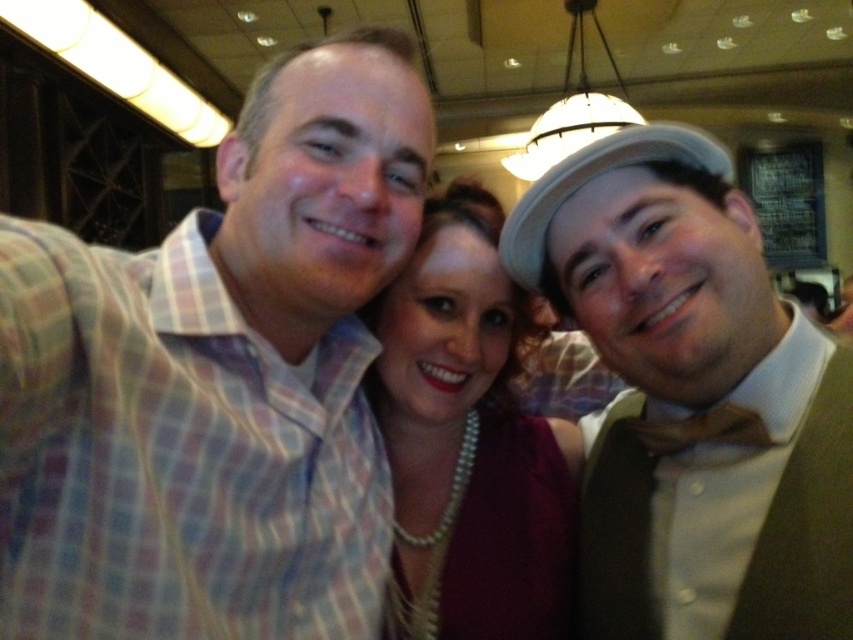
You are a photographer adjusting the camera focus. You notice two accessories at the center of the image, the matte brown bow tie at center and the pearl necklace at center. Which accessory should you focus on first if you want to ensure the shorter one is sharp?

The matte brown bow tie at center is shorter than the pearl necklace at center, so you should focus on the matte brown bow tie at center first to ensure it is sharp.

Based on the photo, you are a photographer trying to adjust the lighting for a group photo. You need to ensure that the matte brown bow tie at center and the pearl necklace at center are both well lit. Since the bow tie is above the necklace, where should you position the key light to best highlight both items?

The matte brown bow tie at center is located above the pearl necklace at center. To best highlight both items, position the key light above the subject so that the light falls naturally from above the bow tie down to the necklace, ensuring both are well lit.